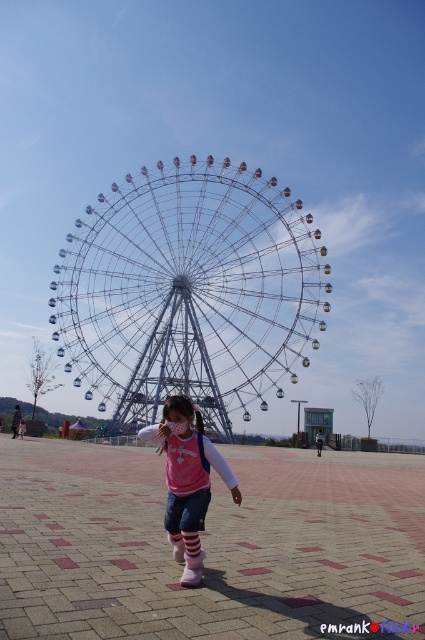
Is metallic wire ferris wheel at center taller than pink fabric shirt at center?

Yes, metallic wire ferris wheel at center is taller than pink fabric shirt at center.

Between metallic wire ferris wheel at center and pink fabric shirt at center, which one is positioned lower?

Positioned lower is pink fabric shirt at center.

You are a GUI agent. You are given a task and a screenshot of the screen. Output one action in this format:
    pyautogui.click(x=<x>, y=<y>)
    Task: Click on the metallic wire ferris wheel at center
    This screenshot has width=425, height=640.
    Given the screenshot: What is the action you would take?
    pyautogui.click(x=189, y=292)

Can you confirm if pink fabric shirt at center is smaller than white matte sock at center?

Incorrect, pink fabric shirt at center is not smaller in size than white matte sock at center.

Between point (192, 528) and point (195, 568), which one is positioned in front?

Point (195, 568) is more forward.

Between point (187, 502) and point (189, 582), which one is positioned in front?

Point (189, 582) is in front.

This screenshot has height=640, width=425. Find the location of `pink fabric shirt at center`. pink fabric shirt at center is located at coordinates (187, 472).

Consider the image. Who is lower down, metallic wire ferris wheel at center or white matte sock at center?

Positioned lower is white matte sock at center.

Which of these two, metallic wire ferris wheel at center or white matte sock at center, stands shorter?

white matte sock at center is shorter.

Is point (272, 387) in front of point (198, 572)?

No, (272, 387) is behind (198, 572).

In order to click on metallic wire ferris wheel at center in this screenshot , I will do `click(189, 292)`.